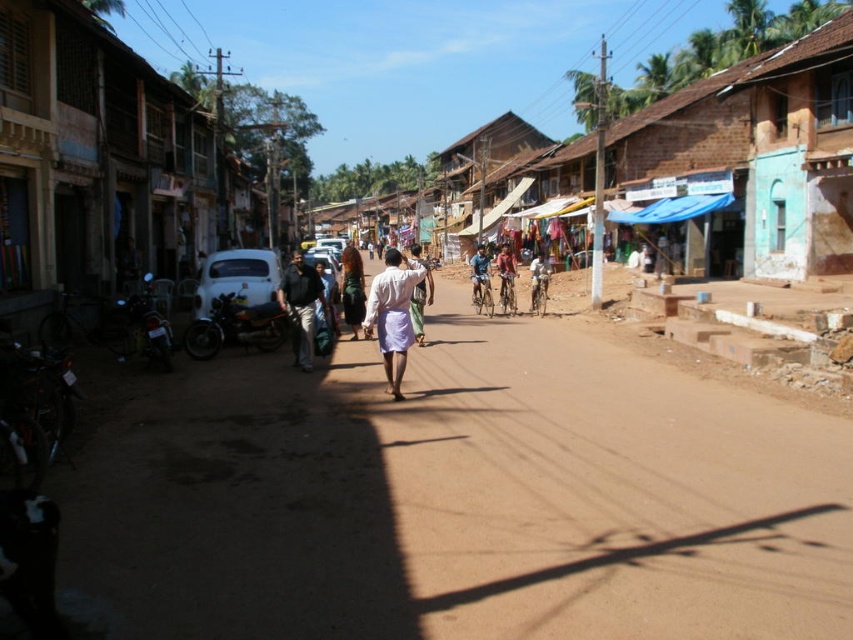
Is the position of white painted wood hut at left more distant than that of white cotton shirt at center?

Yes.

Where is `white painted wood hut at left`? Image resolution: width=853 pixels, height=640 pixels. white painted wood hut at left is located at coordinates (103, 164).

Locate an element on the screen. The image size is (853, 640). white painted wood hut at left is located at coordinates (103, 164).

Can you confirm if shiny black motorcycle at center-left is smaller than shiny black motorcycle at left?

Incorrect, shiny black motorcycle at center-left is not smaller in size than shiny black motorcycle at left.

Is point (252, 317) positioned in front of point (146, 300)?

Yes, it is in front of point (146, 300).

This screenshot has height=640, width=853. I want to click on shiny black motorcycle at center-left, so click(x=235, y=326).

Which of these two, white painted wood hut at left or blue fabric shirt at center, stands taller?

Standing taller between the two is white painted wood hut at left.

Does white painted wood hut at left have a greater height compared to blue fabric shirt at center?

Yes, white painted wood hut at left is taller than blue fabric shirt at center.

Find the location of a particular element. This screenshot has height=640, width=853. white painted wood hut at left is located at coordinates (103, 164).